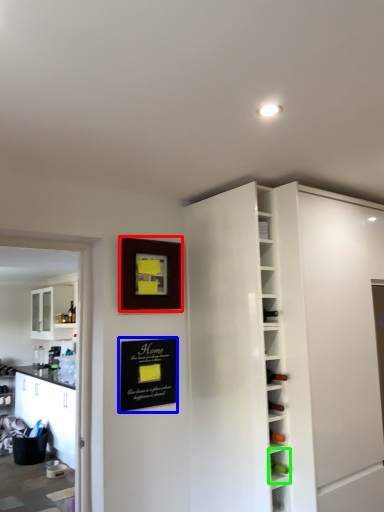
Question: Based on their relative distances, which object is nearer to picture frame (highlighted by a red box)? Choose from bulletin board (highlighted by a blue box) and shelf (highlighted by a green box).

Choices:
 (A) bulletin board
 (B) shelf

Answer: (A)